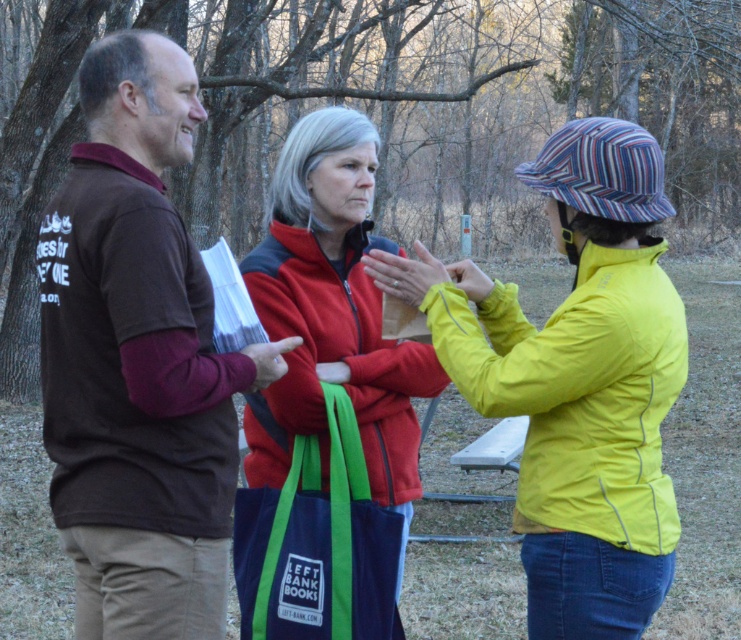
Can you confirm if brown cotton shirt at left is shorter than yellow/waterproof jacket at right?

No, brown cotton shirt at left is not shorter than yellow/waterproof jacket at right.

Is point (53, 500) in front of point (495, 380)?

No, it is not.

Between point (190, 604) and point (628, 499), which one is positioned in front?

Point (628, 499) is in front.

The height and width of the screenshot is (640, 741). I want to click on brown cotton shirt at left, so click(139, 360).

The image size is (741, 640). Describe the element at coordinates (579, 392) in the screenshot. I see `yellow/waterproof jacket at right` at that location.

From the picture: Can you confirm if yellow/waterproof jacket at right is taller than red fleece jacket at center?

No.

Is point (511, 365) closer to viewer compared to point (348, 248)?

Yes, point (511, 365) is closer to viewer.

You are a GUI agent. You are given a task and a screenshot of the screen. Output one action in this format:
    pyautogui.click(x=<x>, y=<y>)
    Task: Click on the yellow/waterproof jacket at right
    The width and height of the screenshot is (741, 640).
    Given the screenshot: What is the action you would take?
    pyautogui.click(x=579, y=392)

Who is higher up, brown cotton shirt at left or red fleece jacket at center?

Positioned higher is red fleece jacket at center.

Does brown cotton shirt at left have a lesser width compared to red fleece jacket at center?

A: No.

Does point (156, 160) come behind point (316, 305)?

No, it is in front of (316, 305).

You are a GUI agent. You are given a task and a screenshot of the screen. Output one action in this format:
    pyautogui.click(x=<x>, y=<y>)
    Task: Click on the brown cotton shirt at left
    
    Given the screenshot: What is the action you would take?
    pyautogui.click(x=139, y=360)